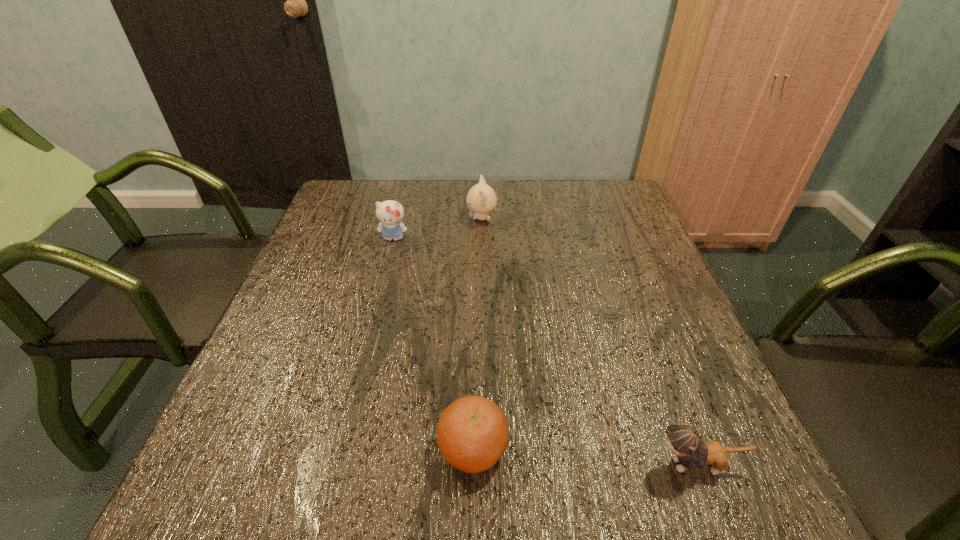
Locate an element on the screen. The width and height of the screenshot is (960, 540). the leftmost kitten is located at coordinates (390, 213).

Where is `the third nearest object`? the third nearest object is located at coordinates (390, 213).

The height and width of the screenshot is (540, 960). What are the coordinates of `the second kitten from left to right` in the screenshot? It's located at coord(481,199).

Where is `the farthest object`? the farthest object is located at coordinates (481, 199).

At what (x,y) coordinates should I click in order to perform the action: click on the nearest kitten. Please return your answer as a coordinate pair (x, y). The width and height of the screenshot is (960, 540). Looking at the image, I should click on (685, 441).

At what (x,y) coordinates should I click in order to perform the action: click on the rightmost kitten. Please return your answer as a coordinate pair (x, y). Image resolution: width=960 pixels, height=540 pixels. Looking at the image, I should click on (685, 441).

The image size is (960, 540). What are the coordinates of `clementine` in the screenshot? It's located at (472, 434).

Where is `vacant space located 0.240m on the front-facing side of the leftmost object`? This screenshot has height=540, width=960. vacant space located 0.240m on the front-facing side of the leftmost object is located at coordinates (375, 310).

This screenshot has width=960, height=540. What are the coordinates of `vacant area situated 0.380m on the face of the farthest kitten` in the screenshot? It's located at (333, 218).

The height and width of the screenshot is (540, 960). I want to click on vacant area situated on the face of the farthest kitten, so click(x=337, y=218).